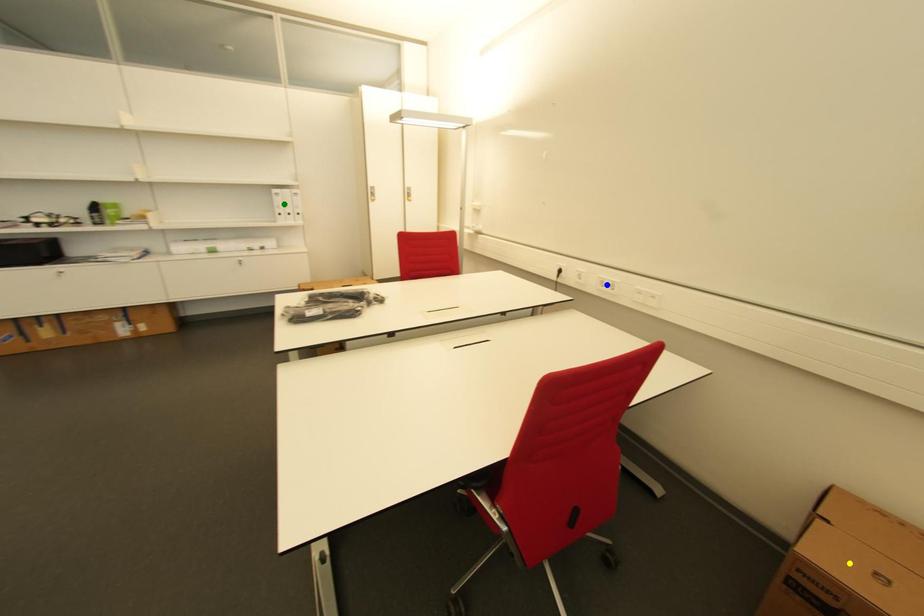
Order these from nearest to farthest:
blue point
green point
yellow point

green point, blue point, yellow point